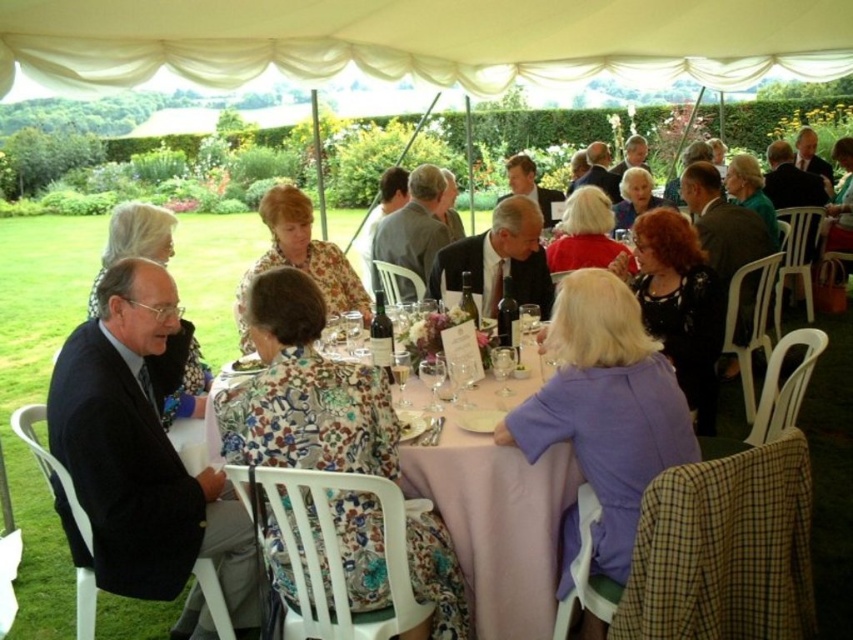
Can you confirm if dark blue suit at left is positioned to the left of transparent glass wine glass at table center?

Correct, you'll find dark blue suit at left to the left of transparent glass wine glass at table center.

Between dark blue suit at left and transparent glass wine glass at table center, which one appears on the right side from the viewer's perspective?

Positioned to the right is transparent glass wine glass at table center.

Which is behind, point (218, 496) or point (506, 372)?

The point (506, 372) is behind.

Find the location of a particular element. The width and height of the screenshot is (853, 640). dark blue suit at left is located at coordinates (141, 452).

Is matte black suit at center wider than green leafy salad at center?

Yes.

Between point (483, 307) and point (234, 368), which one is positioned in front?

Positioned in front is point (234, 368).

Which is in front, point (480, 284) or point (242, 356)?

Point (242, 356)

You are a GUI agent. You are given a task and a screenshot of the screen. Output one action in this format:
    pyautogui.click(x=<x>, y=<y>)
    Task: Click on the matte black suit at center
    Image resolution: width=853 pixels, height=640 pixels.
    Given the screenshot: What is the action you would take?
    pyautogui.click(x=498, y=259)

Can you confirm if floral fabric dress at center is wider than pink fabric table at center?

Yes.

This screenshot has height=640, width=853. What do you see at coordinates (300, 257) in the screenshot?
I see `floral fabric dress at center` at bounding box center [300, 257].

I want to click on floral fabric dress at center, so click(300, 257).